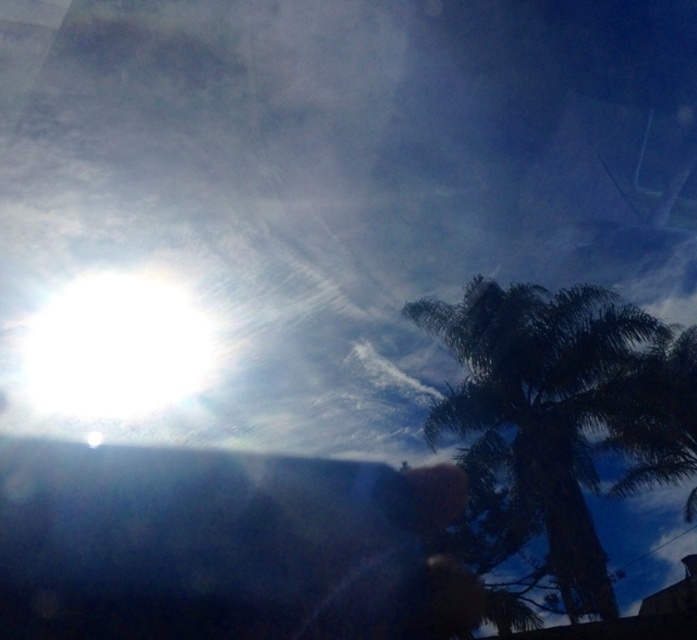
How much distance is there between green leafy palm tree at upper right and white glossy sun at upper left?

11.72 meters

In order to click on green leafy palm tree at upper right in this screenshot , I will do `click(533, 419)`.